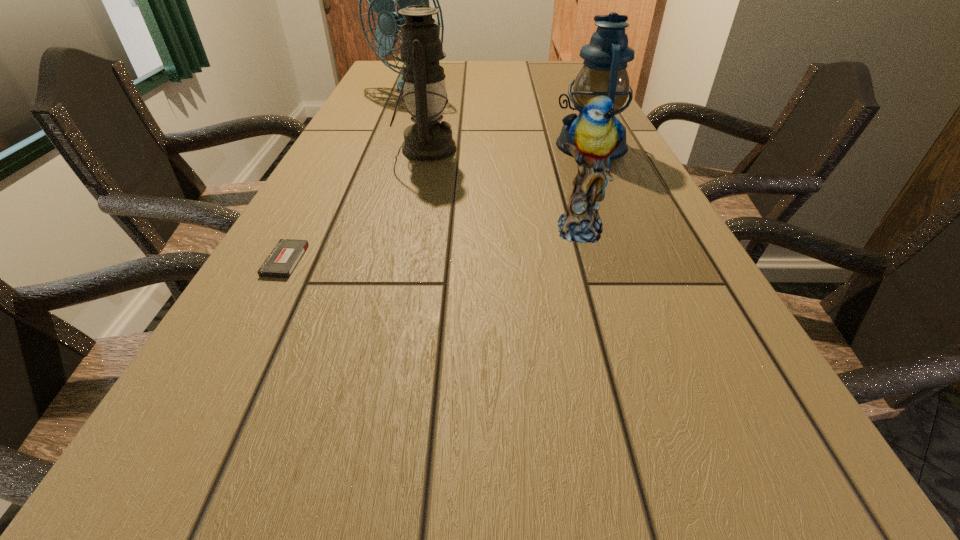
This screenshot has height=540, width=960. Find the location of `vacant region located 0.240m on the face of the parrot`. vacant region located 0.240m on the face of the parrot is located at coordinates (617, 355).

Locate an element on the screen. The width and height of the screenshot is (960, 540). free spot located 0.330m on the front of the videotape is located at coordinates (172, 475).

This screenshot has height=540, width=960. Find the location of `object located in the far edge section of the desktop`. object located in the far edge section of the desktop is located at coordinates (381, 0).

This screenshot has width=960, height=540. I want to click on fan positioned at the left edge, so click(381, 0).

Identify the location of videotape that is positioned at the left edge. (281, 262).

In order to click on lantern located at the right edge in this screenshot , I will do `click(604, 73)`.

This screenshot has height=540, width=960. In order to click on parrot at the right edge in this screenshot , I will do `click(596, 133)`.

Where is `object at the far left corner`? object at the far left corner is located at coordinates (381, 0).

The image size is (960, 540). What are the coordinates of `vacant space at the left edge of the desktop` in the screenshot? It's located at (214, 513).

The image size is (960, 540). Identify the location of blank space at the right edge of the desktop. (665, 219).